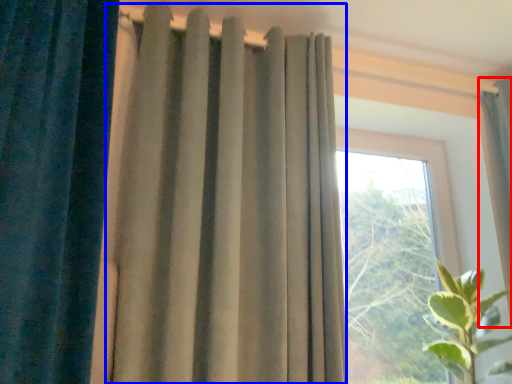
Question: Which object is further to the camera taking this photo, curtain (highlighted by a red box) or curtain (highlighted by a blue box)?

Choices:
 (A) curtain
 (B) curtain

Answer: (A)